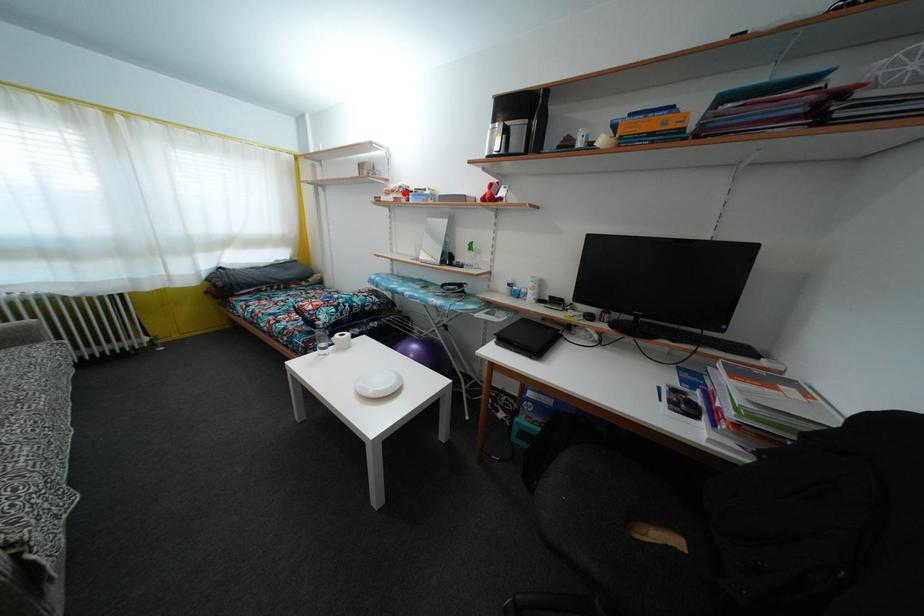
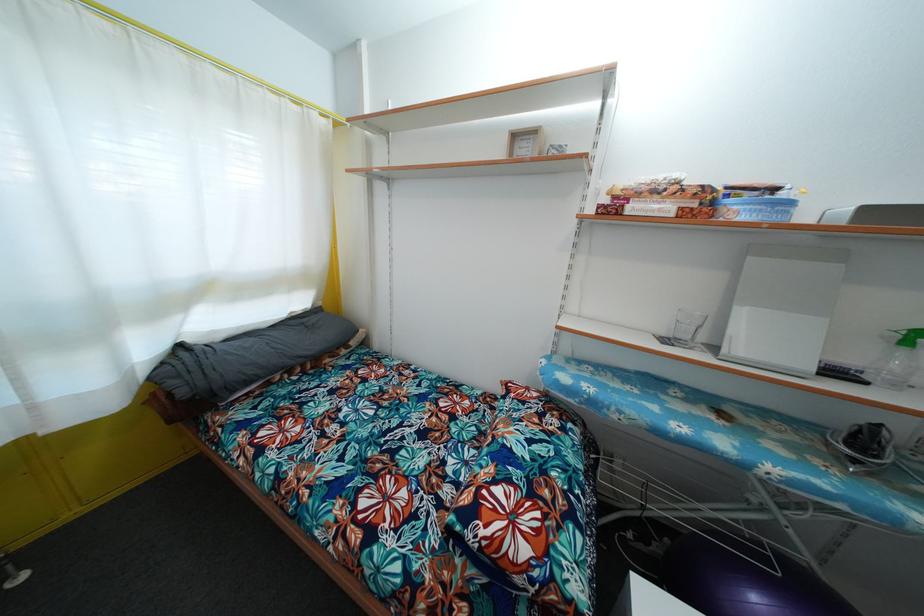
Find the pixel in the second image that matches the highlighted location in the first image.

(683, 188)